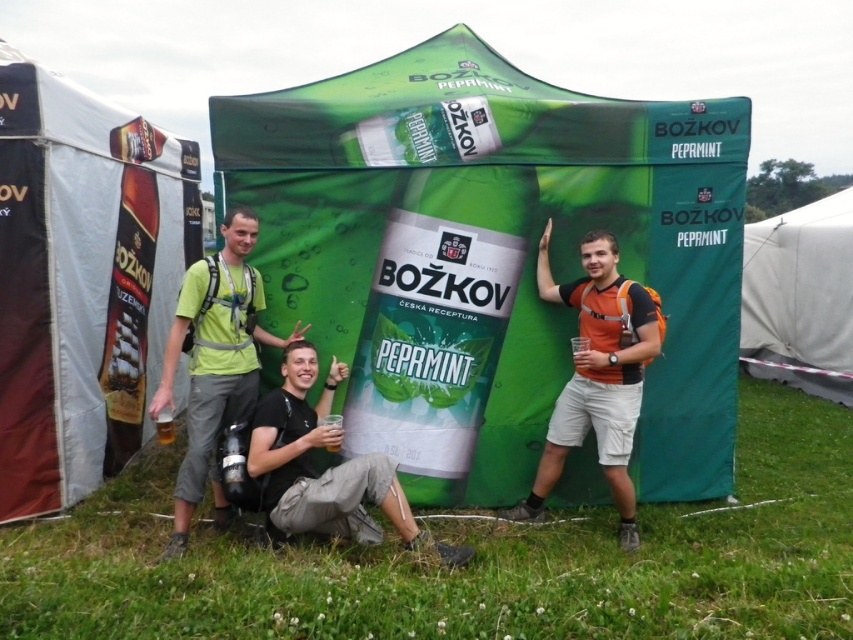
You are a photographer at the event and need to capture a wide shot of the scene. Since the green fabric backpack at center and the white fabric tent at lower right are in the frame, which object will appear wider in the photo?

The white fabric tent at lower right will appear wider in the photo because it has a greater width than the green fabric backpack at center.

You are standing in front of the promotional tent for Bozskov Peppermint and see the green fabric backpack at center. Can you determine if the backpack is positioned to the left or right of the tent?

The green fabric backpack at center is located at point (215, 364), which places it to the right side of the tent.